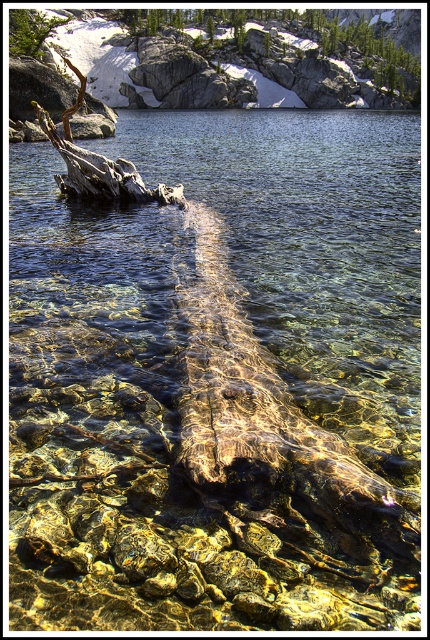
Can you confirm if smooth gray rock at upper center is positioned to the right of green leafy tree at upper left?

Indeed, smooth gray rock at upper center is positioned on the right side of green leafy tree at upper left.

Who is positioned more to the right, smooth gray rock at upper center or green leafy tree at upper left?

smooth gray rock at upper center

This screenshot has width=430, height=640. What are the coordinates of `smooth gray rock at upper center` in the screenshot? It's located at (276, 54).